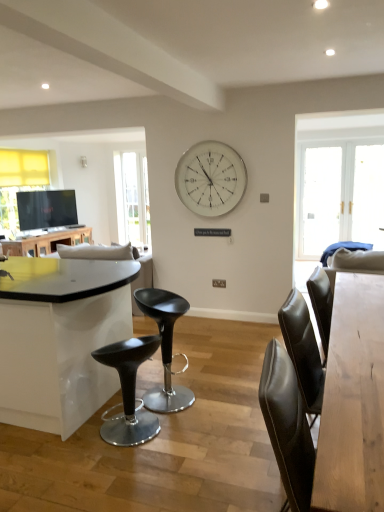
Measure the distance between point (49, 251) and camera.

5.23 meters.

This screenshot has width=384, height=512. Describe the element at coordinates (165, 347) in the screenshot. I see `black plastic stool at center` at that location.

What do you see at coordinates (353, 400) in the screenshot? This screenshot has width=384, height=512. I see `light brown wooden table at right, acting as the 1th table starting from the bottom` at bounding box center [353, 400].

Locate an element on the screen. The image size is (384, 512). light brown wooden table at right, the 2th table positioned from the top is located at coordinates (353, 400).

At what (x,y) coordinates should I click in order to perform the action: click on shiny black stool at center. Please return your answer as a coordinate pair (x, y). Looking at the image, I should click on (129, 391).

From a real-world perspective, does matte black table at left, which is counted as the 1th table, starting from the left, stand above shiny black stool at center?

Yes, from a real-world perspective, matte black table at left, which is counted as the 1th table, starting from the left, is over shiny black stool at center

Considering the sizes of objects matte black table at left, which is counted as the 1th table, starting from the left, and shiny black stool at center in the image provided, who is smaller, matte black table at left, which is counted as the 1th table, starting from the left, or shiny black stool at center?

With smaller size is shiny black stool at center.

Is matte black table at left, which appears as the 2th table when viewed from the front, inside the boundaries of shiny black stool at center, or outside?

matte black table at left, which appears as the 2th table when viewed from the front, is outside shiny black stool at center.

Is matte black table at left, placed as the second table when sorted from bottom to top, in front of or behind shiny black stool at center in the image?

Visually, matte black table at left, placed as the second table when sorted from bottom to top, is located behind shiny black stool at center.

There is a shiny black stool at center. Where is `wall clock above it (from a real-world perspective)`? Image resolution: width=384 pixels, height=512 pixels. wall clock above it (from a real-world perspective) is located at coordinates (210, 178).

How different are the orientations of shiny black stool at center and white glass clock at upper center in degrees?

There is a 134-degree angle between the facing directions of shiny black stool at center and white glass clock at upper center.

Consider the image. Between shiny black stool at center and white glass clock at upper center, which one has smaller width?

With smaller width is white glass clock at upper center.

Is the position of shiny black stool at center more distant than that of white glass clock at upper center?

That is False.

Between point (82, 252) and point (331, 392), which one is positioned behind?

The point (82, 252) is more distant.

You are a GUI agent. You are given a task and a screenshot of the screen. Output one action in this format:
    pyautogui.click(x=<x>, y=<y>)
    Task: Click on the couch positioned vertically above the light brown wooden table at right, which appears as the 2th table when viewed from the left (from a real-world perspective)
    The height and width of the screenshot is (512, 384).
    Given the screenshot: What is the action you would take?
    pyautogui.click(x=116, y=260)

From a real-world perspective, is white fabric couch at center on light brown wooden table at right, the first table when ordered from right to left?

Yes, from a real-world perspective, white fabric couch at center is over light brown wooden table at right, the first table when ordered from right to left

Is white fabric couch at center wider than light brown wooden table at right, the 2th table positioned from the top?

Correct, the width of white fabric couch at center exceeds that of light brown wooden table at right, the 2th table positioned from the top.

At what (x,y) coordinates should I click in order to perform the action: click on wall clock located on the right of white fabric couch at center. Please return your answer as a coordinate pair (x, y). The height and width of the screenshot is (512, 384). Looking at the image, I should click on (210, 178).

From a real-world perspective, is white fabric couch at center located beneath white glass clock at upper center?

Correct, in the physical world, white fabric couch at center is lower than white glass clock at upper center.

Between white fabric couch at center and white glass clock at upper center, which one appears on the right side from the viewer's perspective?

white glass clock at upper center is more to the right.

Is point (101, 256) closer to camera compared to point (233, 201)?

That is True.

Does light brown wooden table at right, the 2th table viewed from the back, have a smaller size compared to shiny black stool at center?

No.

From a real-world perspective, count 1st tables upward from the shiny black stool at center and point to it. Please provide its 2D coordinates.

[(353, 400)]

From the image's perspective, which object appears higher, light brown wooden table at right, acting as the 1th table starting from the bottom, or shiny black stool at center?

light brown wooden table at right, acting as the 1th table starting from the bottom, is shown above in the image.

Looking at this image, in terms of width, does light brown wooden table at right, which appears as the 2th table when viewed from the left, look wider or thinner when compared to shiny black stool at center?

In the image, light brown wooden table at right, which appears as the 2th table when viewed from the left, appears to be more narrow than shiny black stool at center.

Is clear glass door at upper left facing towards white glass clock at upper center?

No, clear glass door at upper left is not aimed at white glass clock at upper center.

Considering the sizes of objects clear glass door at upper left and white glass clock at upper center in the image provided, who is taller, clear glass door at upper left or white glass clock at upper center?

clear glass door at upper left is taller.

From a real-world perspective, is clear glass door at upper left above or below white glass clock at upper center?

In terms of real-world spatial position, clear glass door at upper left is below white glass clock at upper center.

Would you say shiny black stool at center is inside or outside black plastic stool at center?

shiny black stool at center is not inside black plastic stool at center, it's outside.

Would you say shiny black stool at center is to the left or to the right of black plastic stool at center in the picture?

In the image, shiny black stool at center appears on the left side of black plastic stool at center.

Which point is more distant from viewer, (130, 377) or (157, 298)?

The point (157, 298) is more distant.

At what (x,y) coordinates should I click in order to perform the action: click on bar stool on the right of matte black table at left, placed as the second table when sorted from bottom to top. Please return your answer as a coordinate pair (x, y). The width and height of the screenshot is (384, 512). Looking at the image, I should click on (129, 391).

Locate an element on the screen. bar stool directly beneath the white glass clock at upper center (from a real-world perspective) is located at coordinates (129, 391).

From the image, which object appears to be nearer to shiny black stool at center, white fabric couch at center or black plastic stool at center?

black plastic stool at center.

From the image, which object appears to be nearer to shiny black stool at center, white glass clock at upper center or light brown wooden table at right, the first table when ordered from right to left?

light brown wooden table at right, the first table when ordered from right to left.

Considering their positions, is white glass clock at upper center positioned further to white fabric couch at center than light brown wooden table at right, placed as the first table when sorted from front to back?

Among the two, light brown wooden table at right, placed as the first table when sorted from front to back, is located further to white fabric couch at center.

Estimate the real-world distances between objects in this image. Which object is further from black plastic stool at center, white fabric couch at center or light brown wooden table at right, acting as the 1th table starting from the bottom?

The object further to black plastic stool at center is light brown wooden table at right, acting as the 1th table starting from the bottom.

When comparing their distances from matte black table at left, acting as the first table starting from the top, does white glass clock at upper center or shiny black stool at center seem closer?

white glass clock at upper center.

Looking at the image, which one is located closer to white glass clock at upper center, shiny black stool at center or light brown wooden table at right, acting as the 1th table starting from the bottom?

Based on the image, light brown wooden table at right, acting as the 1th table starting from the bottom, appears to be nearer to white glass clock at upper center.

Based on their spatial positions, is matte black table at left, which appears as the 2th table when viewed from the front, or shiny black stool at center closer to light brown wooden table at right, the 2th table viewed from the back?

shiny black stool at center.

Which object lies nearer to the anchor point shiny black stool at center, clear glass door at upper left or white glass clock at upper center?

white glass clock at upper center lies closer to shiny black stool at center than the other object.

In order to click on wall clock located between shiny black stool at center and matte black table at left, positioned as the 1th table in back-to-front order, in the depth direction in this screenshot , I will do `click(210, 178)`.

Where is `couch between shiny black stool at center and matte black table at left, acting as the first table starting from the top, from front to back`? couch between shiny black stool at center and matte black table at left, acting as the first table starting from the top, from front to back is located at coordinates (116, 260).

Locate an element on the screen. chair positioned between shiny black stool at center and clear glass door at upper left from near to far is located at coordinates (165, 347).

Identify the location of couch positioned between light brown wooden table at right, the 2th table viewed from the back, and matte black table at left, acting as the first table starting from the top, from near to far. (116, 260).